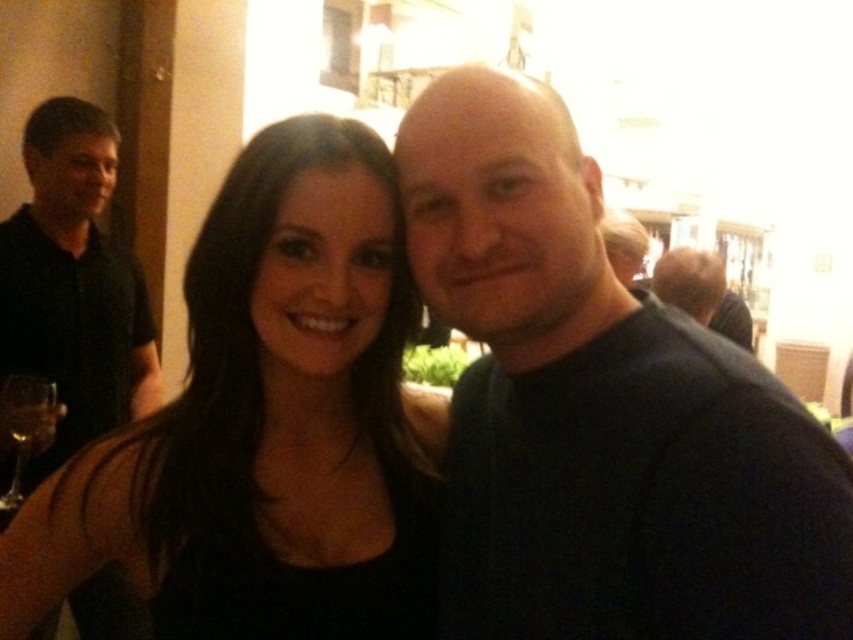
Question: Does dark blue shirt at center appear over black shirt at left?

Choices:
 (A) no
 (B) yes

Answer: (A)

Question: Which object is farther from the camera taking this photo?

Choices:
 (A) dark blue shirt at center
 (B) black matte dress at center

Answer: (B)

Question: Among these points, which one is nearest to the camera?

Choices:
 (A) (131, 282)
 (B) (9, 568)

Answer: (B)

Question: Among these points, which one is farthest from the camera?

Choices:
 (A) (596, 317)
 (B) (45, 387)
 (C) (117, 524)
 (D) (64, 360)

Answer: (D)

Question: Is black matte dress at center above transparent glass wine glass at lower left?

Choices:
 (A) yes
 (B) no

Answer: (A)

Question: Is black matte dress at center thinner than transparent glass wine glass at lower left?

Choices:
 (A) no
 (B) yes

Answer: (A)